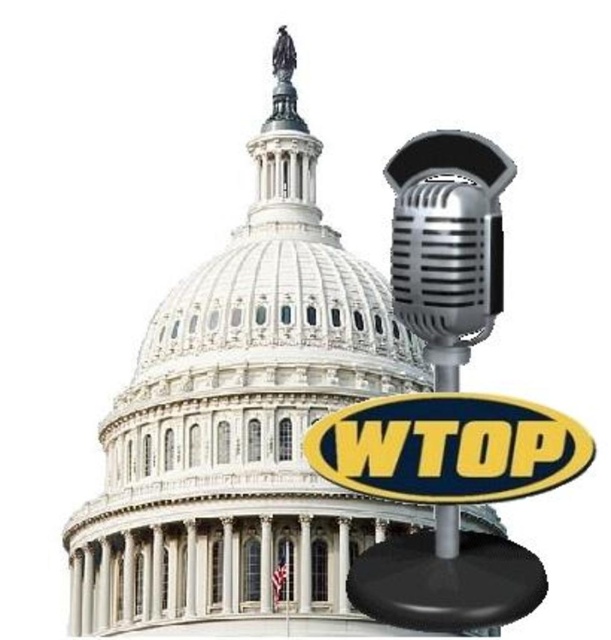
Question: Is yellowmaterial sign at center further to the viewer compared to shiny silver microphone at right?

Choices:
 (A) yes
 (B) no

Answer: (B)

Question: Observing the image, what is the correct spatial positioning of yellowmaterial sign at center in reference to black plastic microphone at right?

Choices:
 (A) above
 (B) below

Answer: (A)

Question: Among these points, which one is nearest to the camera?

Choices:
 (A) pos(455,500)
 (B) pos(433,352)

Answer: (A)

Question: Which object is closer to the camera taking this photo?

Choices:
 (A) shiny silver microphone at right
 (B) yellowmaterial sign at center

Answer: (B)

Question: Does yellowmaterial sign at center have a larger size compared to shiny silver microphone at right?

Choices:
 (A) yes
 (B) no

Answer: (B)

Question: Considering the real-world distances, which object is farthest from the black plastic microphone at right?

Choices:
 (A) shiny silver microphone at right
 (B) yellowmaterial sign at center

Answer: (A)